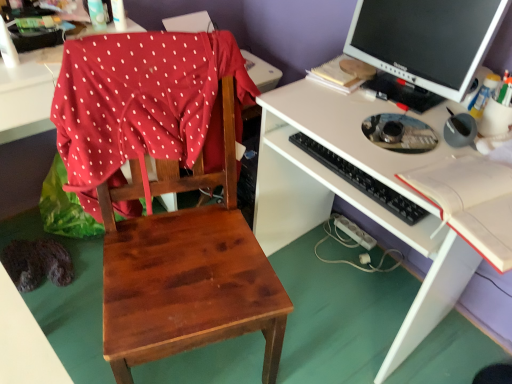
Question: Is white matte desk at center inside or outside of red polka dot fabric at left?

Choices:
 (A) inside
 (B) outside

Answer: (B)

Question: Considering the positions of white matte desk at center and red polka dot fabric at left in the image, is white matte desk at center taller or shorter than red polka dot fabric at left?

Choices:
 (A) short
 (B) tall

Answer: (B)

Question: Estimate the real-world distances between objects in this image. Which object is farther from the black plastic keyboard at center?

Choices:
 (A) white plastic bottle at upper center, the second bottle from the right
 (B) matte black monitor at upper right
 (C) red polka dot fabric at left
 (D) clear plastic bottle at upper left, marked as the third bottle in a bottom-to-top arrangement
 (E) wooden chair at center

Answer: (D)

Question: Which object is positioned farthest from the white matte desk at center?

Choices:
 (A) wooden chair at center
 (B) black plastic keyboard at center
 (C) matte black monitor at upper right
 (D) white plastic bottle at upper center, the second bottle positioned from the bottom
 (E) red polka dot fabric at left

Answer: (D)